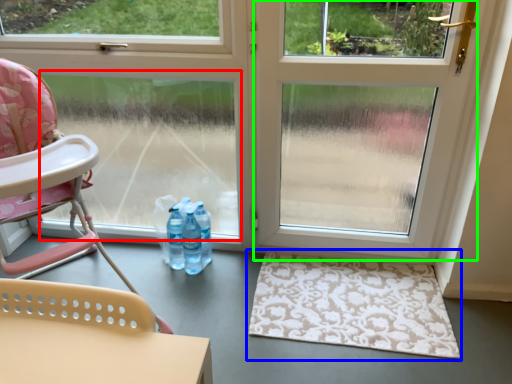
Question: Which is farther away from window screen (highlighted by a red box)? doormat (highlighted by a blue box) or screen door (highlighted by a green box)?

Choices:
 (A) doormat
 (B) screen door

Answer: (A)